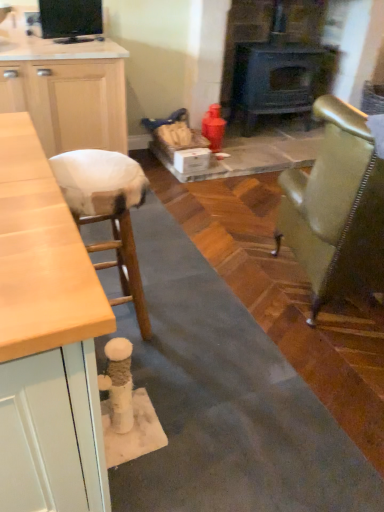
This screenshot has height=512, width=384. What do you see at coordinates (336, 209) in the screenshot? I see `metallic gold chair at right` at bounding box center [336, 209].

Where is `white fabric stool at left`? The height and width of the screenshot is (512, 384). white fabric stool at left is located at coordinates (108, 212).

You are a GUI agent. You are given a task and a screenshot of the screen. Output one action in this format:
    pyautogui.click(x=<x>, y=<y>)
    Task: Click on the metallic gold chair at right
    
    Given the screenshot: What is the action you would take?
    pyautogui.click(x=336, y=209)

From a real-world perspective, is dark gray cast iron wood burning stove at center above or below metallic gold chair at right?

From a real-world perspective, dark gray cast iron wood burning stove at center is physically above metallic gold chair at right.

Which object is positioned more to the left, dark gray cast iron wood burning stove at center or metallic gold chair at right?

dark gray cast iron wood burning stove at center is more to the left.

What are the coordinates of `wood burning stove located above the metallic gold chair at right (from a real-world perspective)` in the screenshot? It's located at (278, 81).

Is dark gray cast iron wood burning stove at center completely or partially outside of metallic gold chair at right?

Yes, dark gray cast iron wood burning stove at center is not within metallic gold chair at right.

Which object is wider, white fabric stool at left or metallic gold chair at right?

With larger width is metallic gold chair at right.

From the picture: Which of these two, white fabric stool at left or metallic gold chair at right, is smaller?

white fabric stool at left is smaller.

Is black glossy tv at upper left not inside metallic gold chair at right?

That's correct, black glossy tv at upper left is outside of metallic gold chair at right.

In the scene shown: Is black glossy tv at upper left turned away from metallic gold chair at right?

No, black glossy tv at upper left's orientation is not away from metallic gold chair at right.

From the image's perspective, which one is positioned higher, black glossy tv at upper left or metallic gold chair at right?

black glossy tv at upper left is shown above in the image.

How many degrees apart are the facing directions of metallic gold chair at right and black glossy tv at upper left?

The facing directions of metallic gold chair at right and black glossy tv at upper left are 138 degrees apart.

Is metallic gold chair at right far from black glossy tv at upper left?

Yes, metallic gold chair at right is far from black glossy tv at upper left.

Could you tell me if metallic gold chair at right is facing black glossy tv at upper left?

No, metallic gold chair at right is not facing towards black glossy tv at upper left.

Who is smaller, metallic gold chair at right or black glossy tv at upper left?

black glossy tv at upper left is smaller.

From a real-world perspective, is metallic gold chair at right located beneath white fabric stool at left?

Incorrect, from a real-world perspective, metallic gold chair at right is higher than white fabric stool at left.

How many degrees apart are the facing directions of metallic gold chair at right and white fabric stool at left?

The angle between the facing direction of metallic gold chair at right and the facing direction of white fabric stool at left is 104 degrees.

Is metallic gold chair at right positioned beyond the bounds of white fabric stool at left?

That's correct, metallic gold chair at right is outside of white fabric stool at left.

From the image's perspective, is metallic gold chair at right located above or below white fabric stool at left?

Clearly, from the image's perspective, metallic gold chair at right is above white fabric stool at left.

From the image's perspective, which is below, black glossy tv at upper left or white fabric stool at left?

white fabric stool at left appears lower in the image.

Are black glossy tv at upper left and white fabric stool at left located far from each other?

Absolutely, black glossy tv at upper left is distant from white fabric stool at left.

Looking at this image, which object is further away from the camera taking this photo, black glossy tv at upper left or white fabric stool at left?

black glossy tv at upper left is further away from the camera.

Is black glossy tv at upper left to the left or to the right of white fabric stool at left in the image?

In the image, black glossy tv at upper left appears on the left side of white fabric stool at left.

Is dark gray cast iron wood burning stove at center thinner than white fabric stool at left?

No.

Consider the image. Between dark gray cast iron wood burning stove at center and white fabric stool at left, which one has larger size?

With larger size is dark gray cast iron wood burning stove at center.

From a real-world perspective, is dark gray cast iron wood burning stove at center above or below white fabric stool at left?

From a real-world perspective, dark gray cast iron wood burning stove at center is physically above white fabric stool at left.

How many degrees apart are the facing directions of dark gray cast iron wood burning stove at center and white fabric stool at left?

dark gray cast iron wood burning stove at center and white fabric stool at left are facing 89.1 degrees away from each other.

At what (x,y) coordinates should I click in order to perform the action: click on wood burning stove that appears above the metallic gold chair at right (from the image's perspective). Please return your answer as a coordinate pair (x, y). This screenshot has width=384, height=512. Looking at the image, I should click on (278, 81).

Where is `chair positioned vertically above the white fabric stool at left (from a real-world perspective)`? This screenshot has height=512, width=384. chair positioned vertically above the white fabric stool at left (from a real-world perspective) is located at coordinates (336, 209).

Based on their spatial positions, is white fabric stool at left or black glossy tv at upper left further from metallic gold chair at right?

black glossy tv at upper left is further to metallic gold chair at right.

From the image, which object appears to be farther from dark gray cast iron wood burning stove at center, metallic gold chair at right or black glossy tv at upper left?

The object further to dark gray cast iron wood burning stove at center is metallic gold chair at right.

Estimate the real-world distances between objects in this image. Which object is further from dark gray cast iron wood burning stove at center, white fabric stool at left or black glossy tv at upper left?

The object further to dark gray cast iron wood burning stove at center is white fabric stool at left.

Based on their spatial positions, is metallic gold chair at right or dark gray cast iron wood burning stove at center further from white fabric stool at left?

Among the two, dark gray cast iron wood burning stove at center is located further to white fabric stool at left.

When comparing their distances from black glossy tv at upper left, does metallic gold chair at right or white fabric stool at left seem further?

Among the two, metallic gold chair at right is located further to black glossy tv at upper left.

Consider the image. When comparing their distances from metallic gold chair at right, does dark gray cast iron wood burning stove at center or black glossy tv at upper left seem further?

dark gray cast iron wood burning stove at center lies further to metallic gold chair at right than the other object.

When comparing their distances from black glossy tv at upper left, does white fabric stool at left or dark gray cast iron wood burning stove at center seem further?

dark gray cast iron wood burning stove at center is further to black glossy tv at upper left.

From the picture: Estimate the real-world distances between objects in this image. Which object is further from black glossy tv at upper left, metallic gold chair at right or dark gray cast iron wood burning stove at center?

metallic gold chair at right lies further to black glossy tv at upper left than the other object.

The width and height of the screenshot is (384, 512). What are the coordinates of `appliance located between white fabric stool at left and dark gray cast iron wood burning stove at center in the depth direction` in the screenshot? It's located at (70, 19).

This screenshot has height=512, width=384. I want to click on stool positioned between metallic gold chair at right and dark gray cast iron wood burning stove at center from near to far, so click(108, 212).

You are a GUI agent. You are given a task and a screenshot of the screen. Output one action in this format:
    pyautogui.click(x=<x>, y=<y>)
    Task: Click on the stool between black glossy tv at upper left and metallic gold chair at right
    
    Given the screenshot: What is the action you would take?
    pyautogui.click(x=108, y=212)

This screenshot has width=384, height=512. Identify the location of appliance between metallic gold chair at right and dark gray cast iron wood burning stove at center along the z-axis. (70, 19).